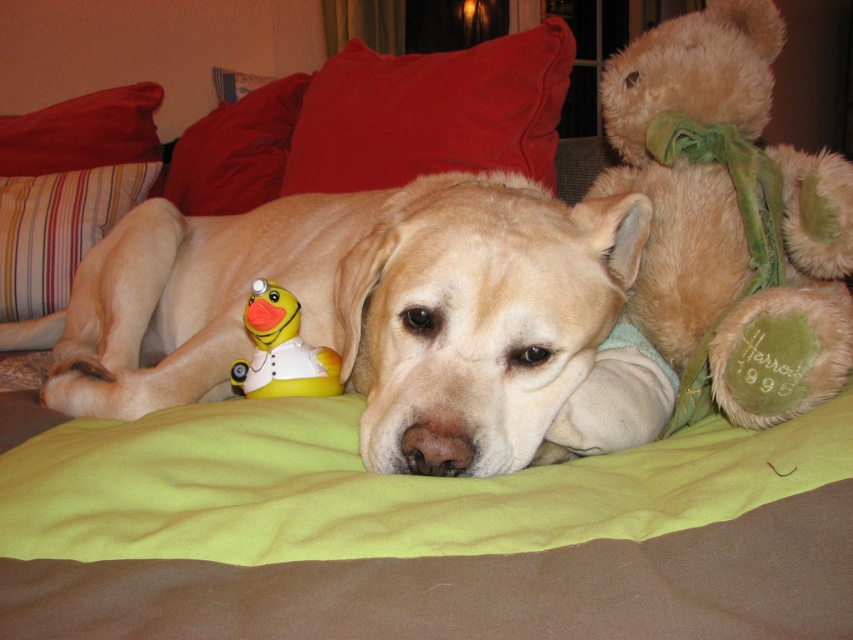
Question: Observing the image, what is the correct spatial positioning of velvety red pillow at upper left in reference to yellow rubber duck at center?

Choices:
 (A) left
 (B) right

Answer: (A)

Question: Which point is closer to the camera taking this photo?

Choices:
 (A) (332, 360)
 (B) (792, 365)

Answer: (B)

Question: Does light brown plush bear at upper right have a smaller size compared to striped fabric pillow at left?

Choices:
 (A) yes
 (B) no

Answer: (B)

Question: Which of the following is the farthest from the observer?

Choices:
 (A) yellow rubber duck at center
 (B) light brown plush bear at upper right
 (C) red cotton pillow at upper left

Answer: (C)

Question: Which of the following is the farthest from the observer?

Choices:
 (A) red cotton pillow at upper left
 (B) golden fur dog at center

Answer: (A)

Question: Is red velvet pillow at upper center below red cotton pillow at upper left?

Choices:
 (A) yes
 (B) no

Answer: (A)